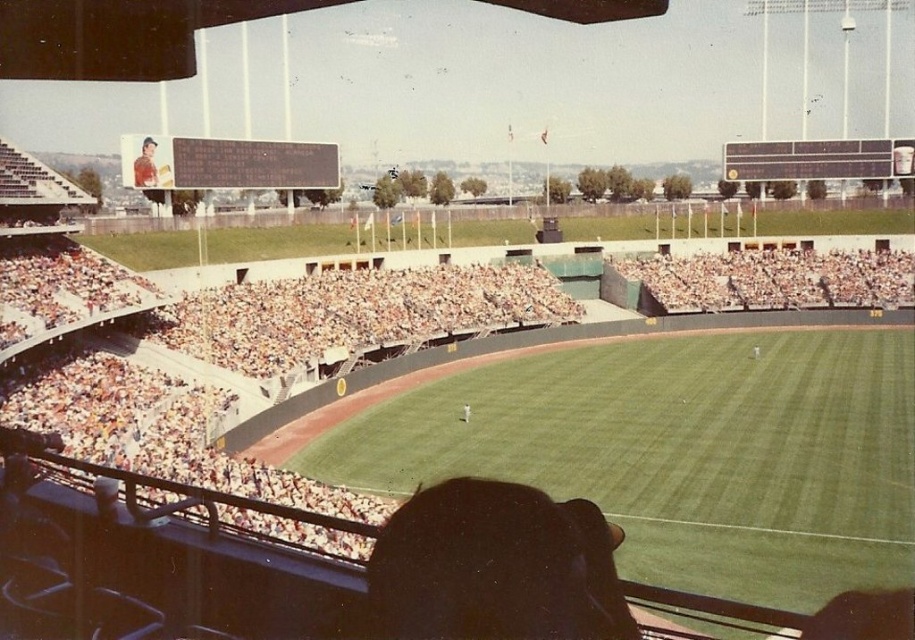
Which is above, brown leather jacket at upper left or white uniform person at center?

brown leather jacket at upper left is above.

At what (x,y) coordinates should I click in order to perform the action: click on brown leather jacket at upper left. Please return your answer as a coordinate pair (x, y). This screenshot has width=915, height=640. Looking at the image, I should click on (145, 164).